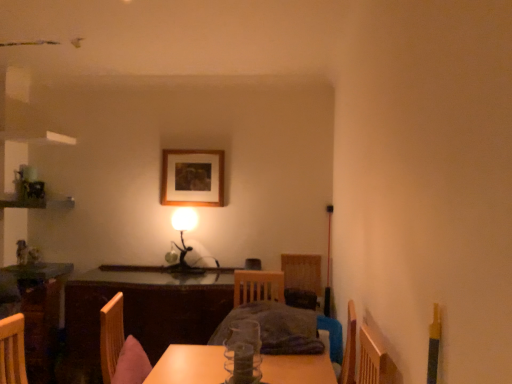
The width and height of the screenshot is (512, 384). Describe the element at coordinates (184, 230) in the screenshot. I see `matte black table lamp at center` at that location.

Where is `wooden table at center`? This screenshot has height=384, width=512. wooden table at center is located at coordinates point(146,309).

Where is `wooden picture frame at center`? The image size is (512, 384). wooden picture frame at center is located at coordinates tap(192, 178).

Find the location of a particular element. matte black table lamp at center is located at coordinates (184, 230).

Considering the sizes of wooden table at center and wooden picture frame at center in the image, is wooden table at center wider or thinner than wooden picture frame at center?

Clearly, wooden table at center has more width compared to wooden picture frame at center.

Which of these two, wooden table at center or wooden picture frame at center, stands taller?

With more height is wooden table at center.

Is wooden table at center bigger or smaller than wooden picture frame at center?

wooden table at center is bigger than wooden picture frame at center.

Is wooden table at center oriented away from wooden picture frame at center?

wooden table at center does not have its back to wooden picture frame at center.

Would you say matte black table lamp at center is inside or outside clear glass vase at center?

matte black table lamp at center is outside clear glass vase at center.

This screenshot has width=512, height=384. Identify the location of tableware to the right of matte black table lamp at center. (242, 363).

Considering the sizes of objects matte black table lamp at center and clear glass vase at center in the image provided, who is taller, matte black table lamp at center or clear glass vase at center?

Standing taller between the two is matte black table lamp at center.

Is matte black table lamp at center aimed at clear glass vase at center?

No, matte black table lamp at center is not facing towards clear glass vase at center.

Is matte black table lamp at center at the back of clear glass vase at center?

No, clear glass vase at center is not facing away from matte black table lamp at center.

From the image's perspective, who appears lower, clear glass vase at center or matte black table lamp at center?

clear glass vase at center.

Is clear glass vase at center taller than matte black table lamp at center?

Incorrect, the height of clear glass vase at center is not larger of that of matte black table lamp at center.

In the scene shown: Considering the positions of objects clear glass vase at center and matte black table lamp at center in the image provided, who is more to the left, clear glass vase at center or matte black table lamp at center?

From the viewer's perspective, matte black table lamp at center appears more on the left side.

Is clear glass vase at center bigger or smaller than wooden table at center?

Clearly, clear glass vase at center is smaller in size than wooden table at center.

At what (x,y) coordinates should I click in order to perform the action: click on table that is behind the clear glass vase at center. Please return your answer as a coordinate pair (x, y). Looking at the image, I should click on (146, 309).

From the image's perspective, between clear glass vase at center and wooden table at center, which one is located above?

clear glass vase at center, from the image's perspective.

Based on the photo, does clear glass vase at center appear on the left side of wooden table at center?

Incorrect, clear glass vase at center is not on the left side of wooden table at center.

How far apart are wooden picture frame at center and clear glass vase at center?

The distance of wooden picture frame at center from clear glass vase at center is 1.63 meters.

Could clear glass vase at center be considered to be inside wooden picture frame at center?

No.

Which of these two, wooden picture frame at center or clear glass vase at center, is bigger?

With larger size is wooden picture frame at center.

From the image's perspective, would you say wooden picture frame at center is shown under clear glass vase at center?

No, from the image's perspective, wooden picture frame at center is not below clear glass vase at center.

From the image's perspective, between wooden table at center and clear glass vase at center, who is located below?

wooden table at center.

Is wooden table at center positioned in front of clear glass vase at center?

No, it is behind clear glass vase at center.

Considering the positions of objects wooden table at center and clear glass vase at center in the image provided, who is more to the right, wooden table at center or clear glass vase at center?

→ Positioned to the right is clear glass vase at center.

Is matte black table lamp at center looking in the opposite direction of wooden table at center?

No.

Consider the image. Measure the distance between matte black table lamp at center and wooden table at center.

matte black table lamp at center is 23.24 inches away from wooden table at center.

In the scene shown: From a real-world perspective, relative to wooden table at center, is matte black table lamp at center vertically above or below?

In terms of real-world spatial position, matte black table lamp at center is above wooden table at center.

Could wooden table at center be considered to be inside matte black table lamp at center?

Definitely not — wooden table at center is not inside matte black table lamp at center.

Identify the location of table lying on the left of wooden picture frame at center. (146, 309).

This screenshot has width=512, height=384. What are the coordinates of `tableware that appears below the matte black table lamp at center (from a real-world perspective)` in the screenshot? It's located at (242, 363).

Looking at the image, which one is located further to matte black table lamp at center, wooden picture frame at center or clear glass vase at center?

clear glass vase at center is positioned further to the anchor matte black table lamp at center.

Estimate the real-world distances between objects in this image. Which object is further from matte black table lamp at center, wooden table at center or clear glass vase at center?

Among the two, clear glass vase at center is located further to matte black table lamp at center.

Estimate the real-world distances between objects in this image. Which object is further from matte black table lamp at center, clear glass vase at center or wooden table at center?

clear glass vase at center is positioned further to the anchor matte black table lamp at center.

Looking at the image, which one is located closer to clear glass vase at center, matte black table lamp at center or wooden picture frame at center?

matte black table lamp at center is positioned closer to the anchor clear glass vase at center.

When comparing their distances from wooden table at center, does wooden picture frame at center or clear glass vase at center seem closer?

wooden picture frame at center is closer to wooden table at center.

Based on their spatial positions, is wooden picture frame at center or matte black table lamp at center further from clear glass vase at center?

wooden picture frame at center is further to clear glass vase at center.

Considering their positions, is wooden table at center positioned further to clear glass vase at center than matte black table lamp at center?

Based on the image, matte black table lamp at center appears to be further to clear glass vase at center.

From the picture: From the image, which object appears to be farther from wooden table at center, clear glass vase at center or wooden picture frame at center?

Among the two, clear glass vase at center is located further to wooden table at center.

The image size is (512, 384). Identify the location of table lamp between wooden picture frame at center and wooden table at center in the vertical direction. (184, 230).

Where is `table between clear glass vase at center and wooden picture frame at center along the z-axis`? The width and height of the screenshot is (512, 384). table between clear glass vase at center and wooden picture frame at center along the z-axis is located at coordinates (146, 309).

Image resolution: width=512 pixels, height=384 pixels. What are the coordinates of `table lamp between clear glass vase at center and wooden picture frame at center in the front-back direction` in the screenshot? It's located at (184, 230).

You are a GUI agent. You are given a task and a screenshot of the screen. Output one action in this format:
    pyautogui.click(x=<x>, y=<y>)
    Task: Click on the table located between clear glass vase at center and matte black table lamp at center in the depth direction
    This screenshot has height=384, width=512.
    Given the screenshot: What is the action you would take?
    pyautogui.click(x=146, y=309)